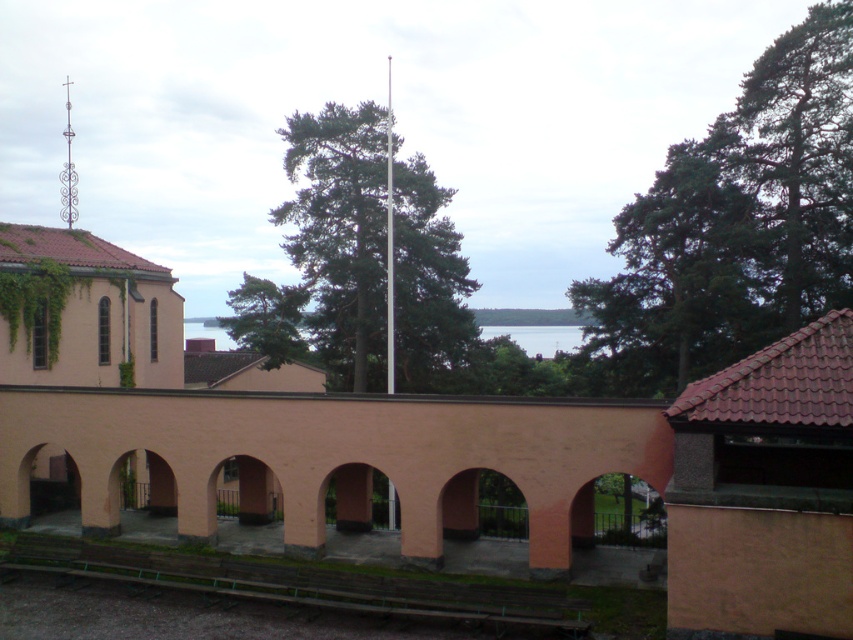
Does green leafy tree at center appear under silver metallic flag pole at center?

Indeed, green leafy tree at center is positioned under silver metallic flag pole at center.

Where is `green leafy tree at center`? green leafy tree at center is located at coordinates (267, 317).

Identify the location of green leafy tree at center. point(267,317).

I want to click on green leafy tree at upper right, so click(x=682, y=278).

Which is below, green leafy tree at upper right or green needle-like leaves at upper right?

green leafy tree at upper right is below.

The image size is (853, 640). I want to click on green leafy tree at upper right, so click(x=682, y=278).

Locate an element on the screen. This screenshot has width=853, height=640. green leafy tree at upper right is located at coordinates coord(682,278).

From the picture: Can you confirm if green needle-like leaves at upper right is taller than silver metallic flag pole at center?

Incorrect, green needle-like leaves at upper right's height is not larger of silver metallic flag pole at center's.

Who is more distant from viewer, (834,81) or (387,72)?

Positioned behind is point (387,72).

Between point (849, 156) and point (392, 358), which one is positioned in front?

Positioned in front is point (392, 358).

Image resolution: width=853 pixels, height=640 pixels. I want to click on green needle-like leaves at upper right, so click(798, 161).